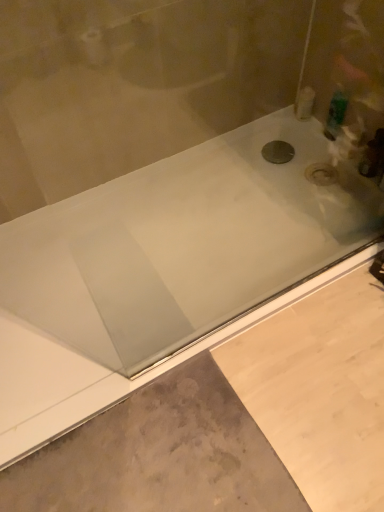
This screenshot has height=512, width=384. I want to click on unoccupied space behind black metallic drain at center, so click(272, 136).